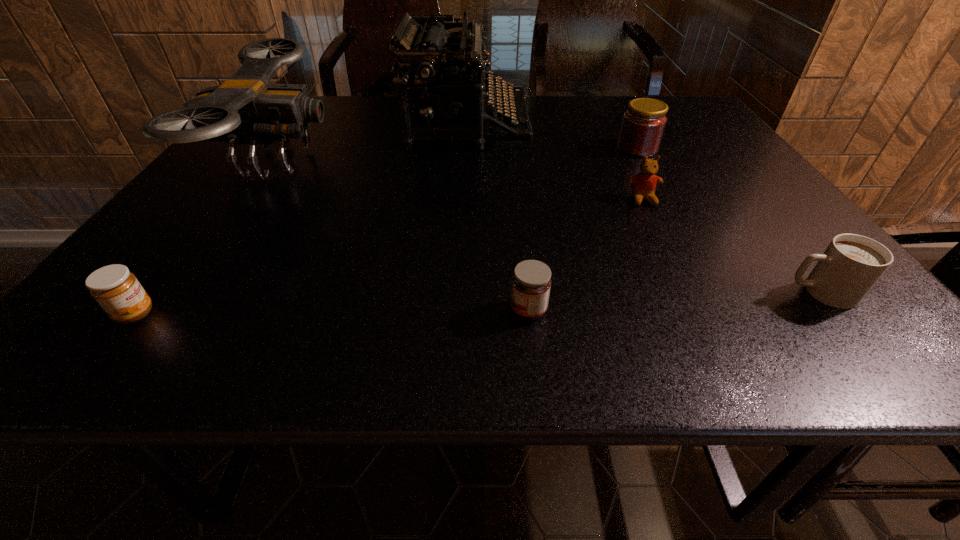
You are a GUI agent. You are given a task and a screenshot of the screen. Output one action in this format:
    pyautogui.click(x=<x>, y=<y>)
    Task: Click on the typewriter
    The height and width of the screenshot is (540, 960).
    Given the screenshot: What is the action you would take?
    pyautogui.click(x=430, y=110)

At what (x,y) coordinates should I click in order to perform the action: click on drone. Please return your answer as a coordinate pair (x, y). This screenshot has width=960, height=540. Looking at the image, I should click on (246, 109).

Image resolution: width=960 pixels, height=540 pixels. What are the coordinates of `the tallest jam` in the screenshot? It's located at (643, 124).

At what (x,y) coordinates should I click in order to perform the action: click on the rightmost jam. Please return your answer as a coordinate pair (x, y). The width and height of the screenshot is (960, 540). Looking at the image, I should click on pos(643,124).

Locate an element on the screen. The image size is (960, 540). teddy bear is located at coordinates (643, 185).

Locate an element on the screen. The image size is (960, 540). the rightmost object is located at coordinates (x=850, y=266).

Image resolution: width=960 pixels, height=540 pixels. I want to click on the second jam from right to left, so [531, 282].

Identify the location of the leftmost jam. This screenshot has height=540, width=960. (117, 290).

Locate an element on the screen. The image size is (960, 540). blank space located on the typing side of the typewriter is located at coordinates (590, 125).

I want to click on blank area located on the front-facing side of the drone, so click(367, 164).